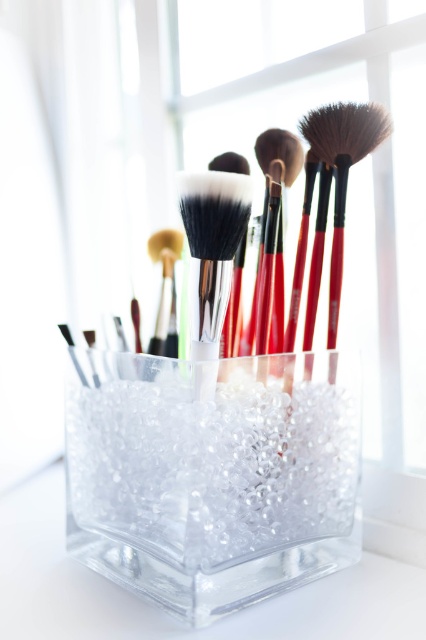
Question: Which object is positioned farthest from the brown synthetic hair brush at upper right?

Choices:
 (A) clear crystal glass at center
 (B) red matte brush at center
 (C) matte black brush at center

Answer: (C)

Question: Does brown synthetic hair brush at upper right have a larger size compared to matte black brush at center?

Choices:
 (A) no
 (B) yes

Answer: (B)

Question: Which is farther from the matte black brush at center?

Choices:
 (A) soft white bristles at center
 (B) brown synthetic hair brush at upper right
 (C) clear crystal glass at center
 (D) red matte brush at center

Answer: (A)

Question: Is brown synthetic hair brush at upper right thinner than matte black brush at center?

Choices:
 (A) no
 (B) yes

Answer: (A)

Question: Does red matte brush at center have a larger size compared to matte black brush at center?

Choices:
 (A) no
 (B) yes

Answer: (B)

Question: Which point is farther from the camera taking this photo?

Choices:
 (A) (359, 125)
 (B) (224, 260)

Answer: (A)